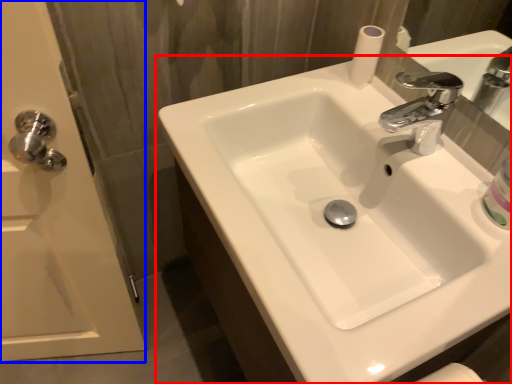
Question: Which of the following is the farthest to the observer, sink (highlighted by a red box) or screen door (highlighted by a blue box)?

Choices:
 (A) sink
 (B) screen door

Answer: (B)